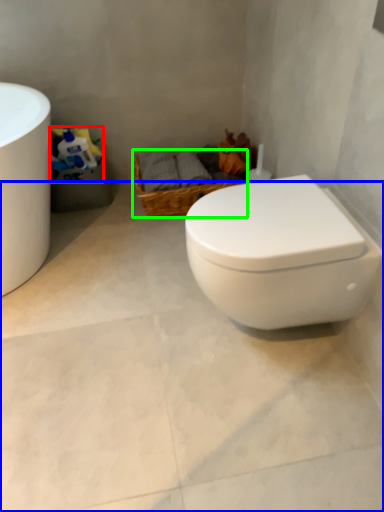
Question: Considering the real-world distances, which object is closest to toilet paper (highlighted by a red box)? concrete (highlighted by a blue box) or basket (highlighted by a green box).

Choices:
 (A) concrete
 (B) basket

Answer: (B)